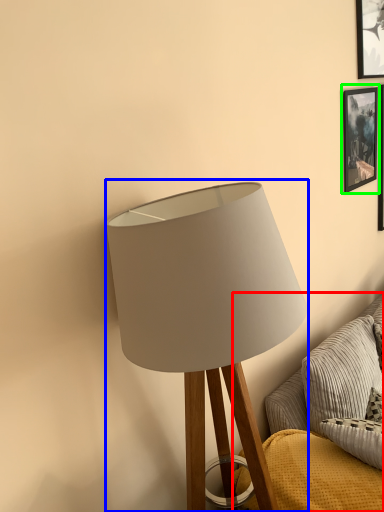
Question: Considering the real-world distances, which object is farthest from couch (highlighted by a red box)? lamp (highlighted by a blue box) or picture frame (highlighted by a green box)?

Choices:
 (A) lamp
 (B) picture frame

Answer: (B)